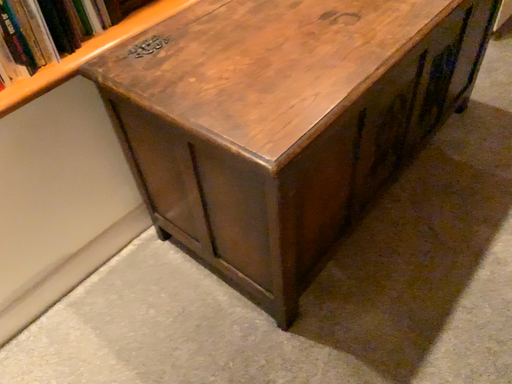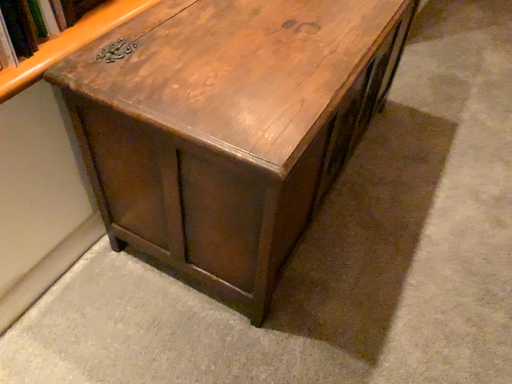
Question: Which way did the camera rotate in the video?

Choices:
 (A) rotated left
 (B) rotated right

Answer: (B)